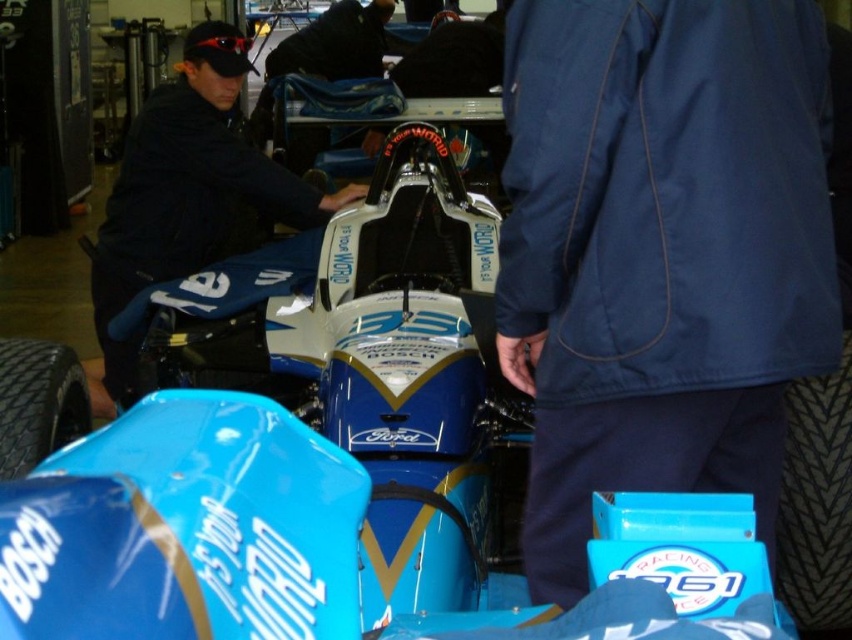
Question: Is dark blue jacket at center positioned behind black rubber tire at lower left?

Choices:
 (A) no
 (B) yes

Answer: (B)

Question: Which is nearer to the navy blue jacket at center?

Choices:
 (A) black rubber tire at lower left
 (B) dark blue jacket at center

Answer: (A)

Question: Which of the following is the farthest from the observer?

Choices:
 (A) navy blue jacket at center
 (B) dark blue jacket at center

Answer: (B)

Question: Can you confirm if navy blue jacket at center is wider than black rubber tire at lower left?

Choices:
 (A) no
 (B) yes

Answer: (B)

Question: Which object is the farthest from the dark blue jacket at center?

Choices:
 (A) navy blue jacket at center
 (B) black rubber tire at lower left

Answer: (A)

Question: Can you confirm if dark blue jacket at center is bigger than black rubber tire at lower left?

Choices:
 (A) no
 (B) yes

Answer: (B)